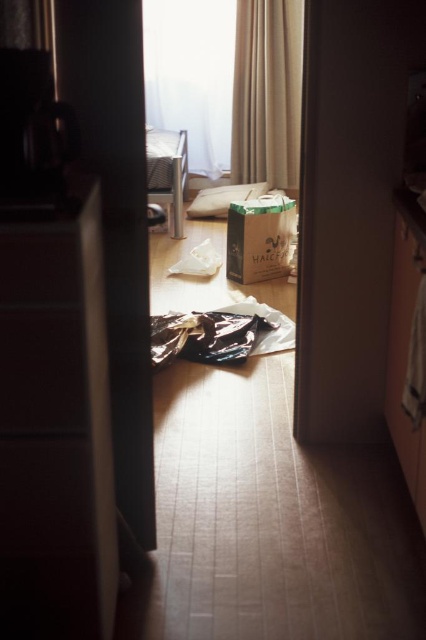
Consider the image. You are organizing the room and want to place the matte black drawer at left and the white paper bag at center into a storage container. Which object requires a larger container?

The white paper bag at center requires a larger container because the matte black drawer at left occupies less space than it.